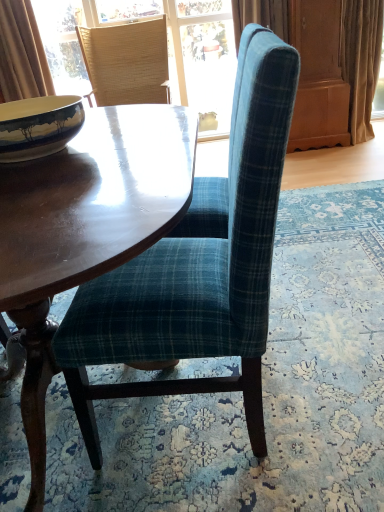
Where is `free space in front of matte ceramic bowl at left`? The width and height of the screenshot is (384, 512). free space in front of matte ceramic bowl at left is located at coordinates (55, 186).